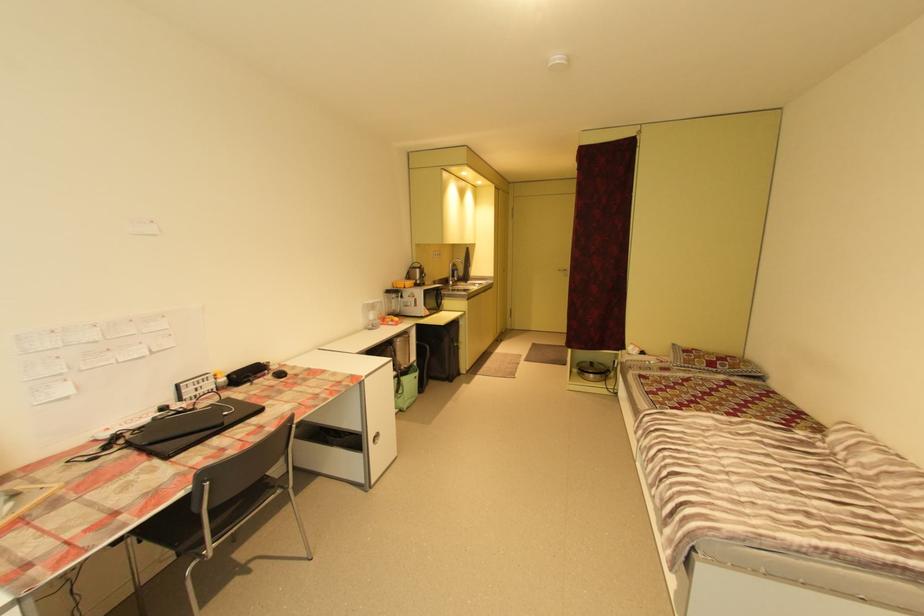
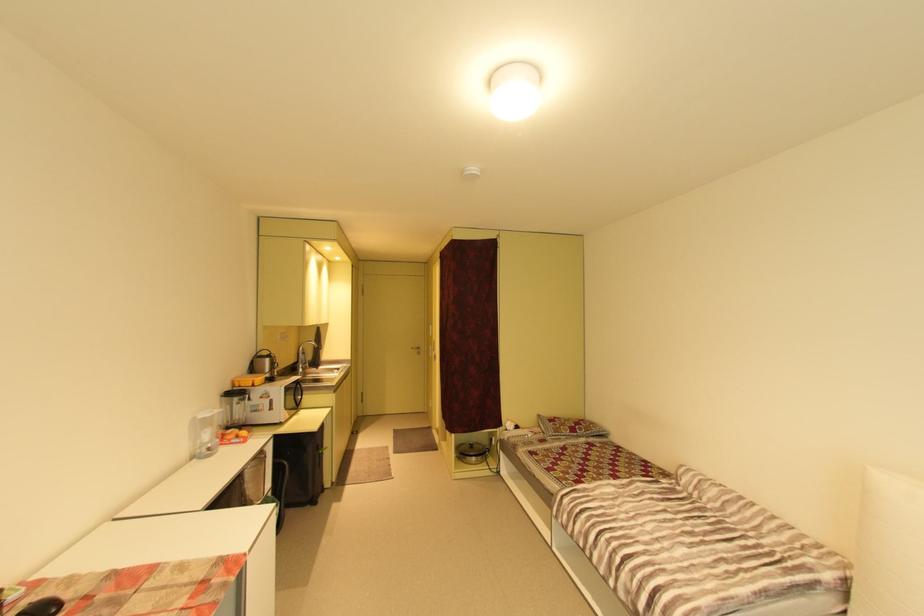
In the second image, find the point that corresponds to the point at 565,270 in the first image.

(419, 349)